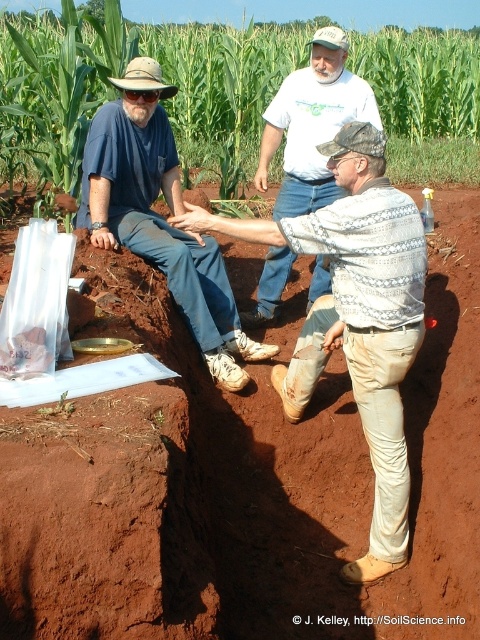
You are a soil scientist examining the scene. You notice a point marked at coordinates (x=356, y=316). Based on the description, where is this point located in relation to the soil pit and the tools on the left?

The point at coordinates (x=356, y=316) is located on the worn beige pants at center, which is not part of the soil pit or the tools on the left side.